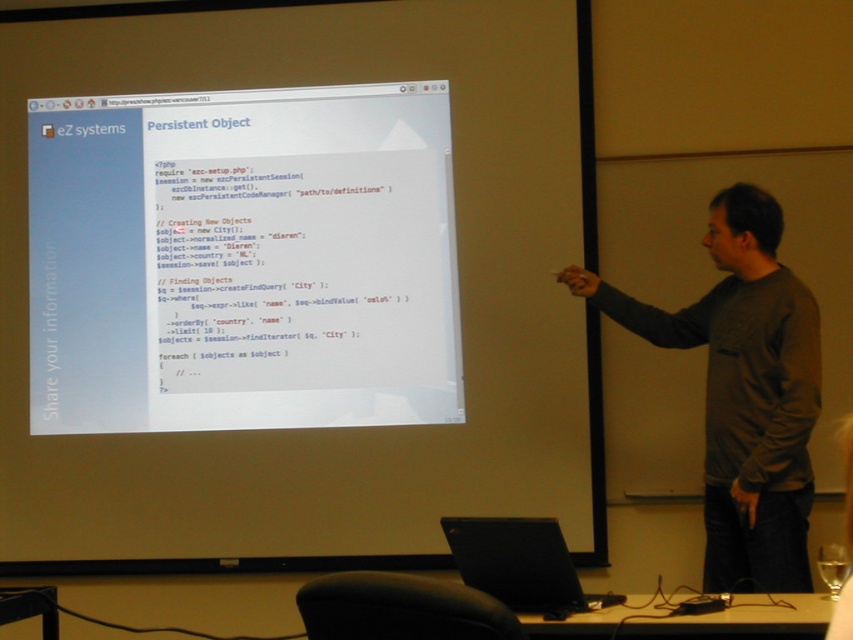
Looking at this image, imagine you are a photographer adjusting your camera focus. You need to focus on both the point at coordinates point (189, 120) and the point at coordinates point (583, 609) in the image. Which point should you focus on first to ensure the closest one is sharp?

You should focus on point (583, 609) first because it is closer to the camera than point (189, 120), ensuring the closer point is in sharp focus.

You are a photographer setting up for an event. You have a black matte laptop at lower center and a clear glass at lower right in your frame. Which object is closer to the camera?

The black matte laptop at lower center is closer to the camera because it is positioned above the clear glass at lower right, indicating it is nearer in the scene.